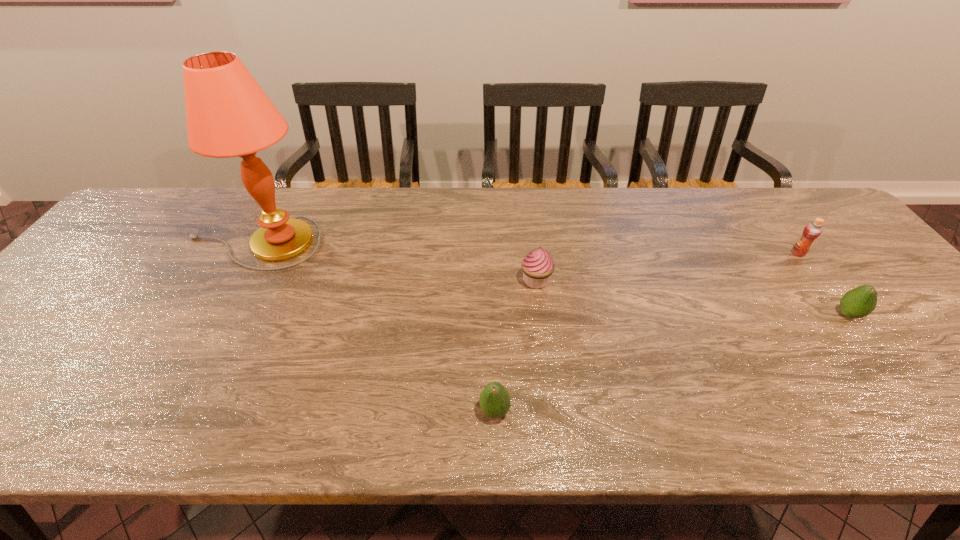
Identify the location of vacant point located between the right avocado and the second object from left to right. The width and height of the screenshot is (960, 540). (671, 362).

Locate an element on the screen. This screenshot has width=960, height=540. free space between the right avocado and the fourth object from right to left is located at coordinates (671, 362).

This screenshot has width=960, height=540. Find the location of `unoccupied area between the right avocado and the orange juice`. unoccupied area between the right avocado and the orange juice is located at coordinates (823, 284).

I want to click on vacant space in between the third object from right to left and the tallest object, so click(395, 262).

The width and height of the screenshot is (960, 540). I want to click on empty location between the second nearest object and the third object from left to right, so click(692, 298).

Locate an element on the screen. The height and width of the screenshot is (540, 960). free space that is in between the cupcake and the orange juice is located at coordinates (667, 267).

This screenshot has height=540, width=960. In order to click on free point between the nearest object and the lamp in this screenshot , I will do `click(373, 327)`.

You are a GUI agent. You are given a task and a screenshot of the screen. Output one action in this format:
    pyautogui.click(x=<x>, y=<y>)
    Task: Click on the free space between the leftmost object and the orange juice
    
    Given the screenshot: What is the action you would take?
    pyautogui.click(x=525, y=248)

This screenshot has height=540, width=960. Identify the location of vacant region between the third object from right to left and the farther avocado. (692, 298).

This screenshot has height=540, width=960. I want to click on vacant area that lies between the orange juice and the cupcake, so click(x=667, y=267).